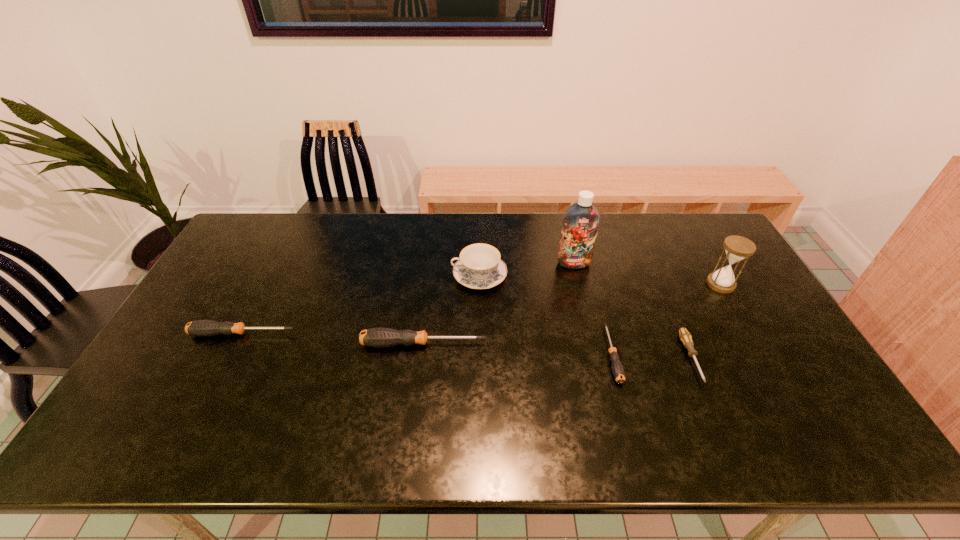
Please point a free position for a screwdriver on the right. Please provide its 2D coordinates. Your answer should be formatted as a tuple, i.e. [(x, y)], where the tuple contains the x and y coordinates of a point satisfying the conditions above.

[(809, 366)]